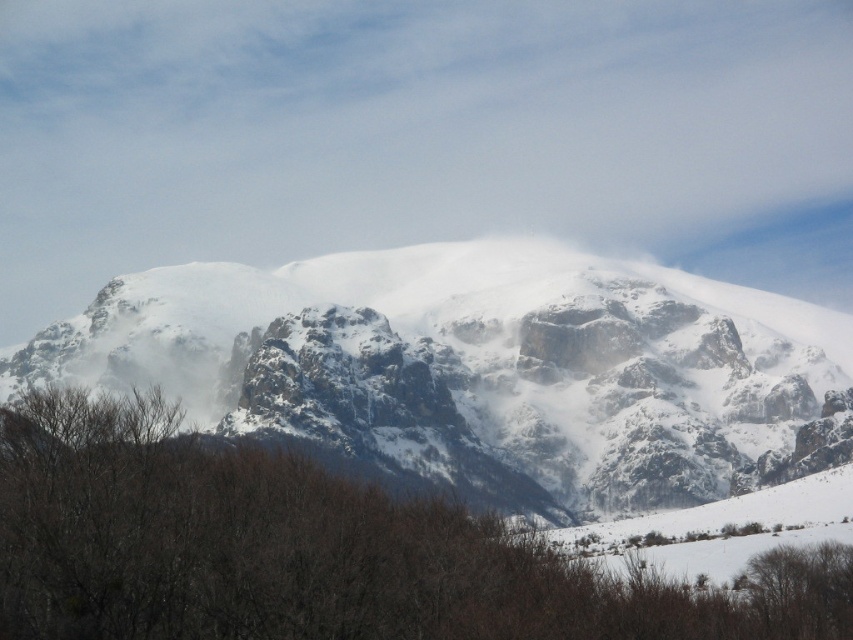
Question: Can you confirm if white snow-covered mountain at center is thinner than brown matte tree at lower center?

Choices:
 (A) no
 (B) yes

Answer: (A)

Question: Does white snow-covered mountain at center appear on the right side of brown matte tree at lower center?

Choices:
 (A) yes
 (B) no

Answer: (A)

Question: Where is white snow-covered mountain at center located in relation to brown matte tree at lower center in the image?

Choices:
 (A) left
 (B) right

Answer: (B)

Question: Which point is farther to the camera?

Choices:
 (A) (582, 380)
 (B) (338, 525)

Answer: (A)

Question: Which point is closer to the camera?

Choices:
 (A) brown matte tree at lower center
 (B) white snow-covered mountain at center

Answer: (A)

Question: Among these points, which one is nearest to the camera?

Choices:
 (A) (86, 477)
 (B) (694, 394)

Answer: (A)